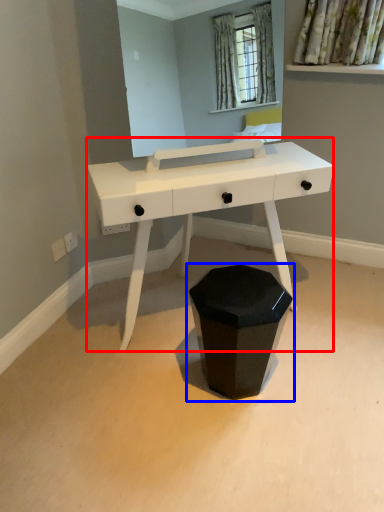
Question: Which of the following is the closest to the observer, table (highlighted by a red box) or waste container (highlighted by a blue box)?

Choices:
 (A) table
 (B) waste container

Answer: (A)